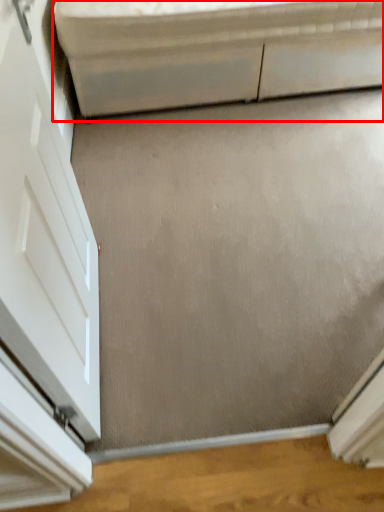
Question: From the image's perspective, what is the correct spatial positioning of furniture (annotated by the red box) in reference to door?

Choices:
 (A) above
 (B) below

Answer: (A)